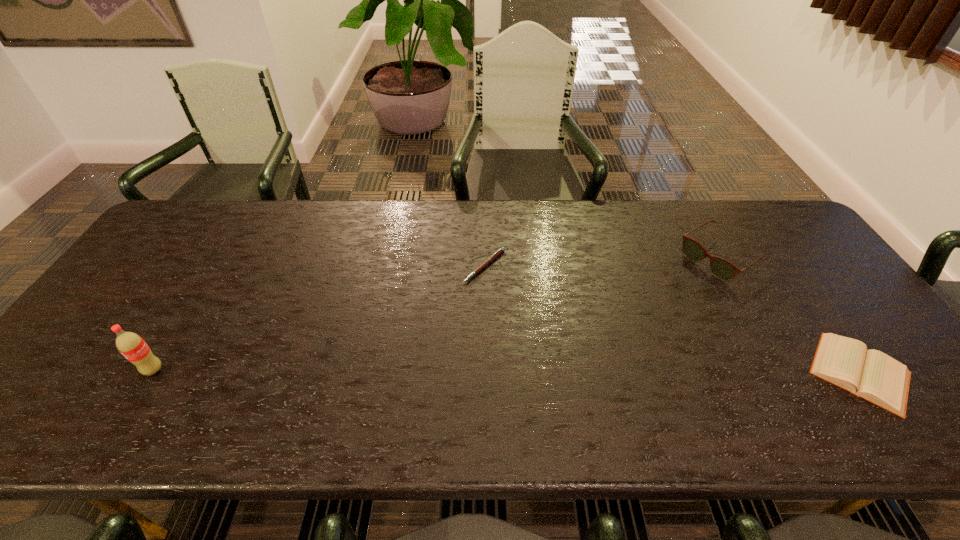
I want to click on vacant region at the near edge of the desktop, so click(770, 381).

I want to click on free space at the right edge of the desktop, so click(847, 299).

Where is `free space at the far left corner`? Image resolution: width=960 pixels, height=540 pixels. free space at the far left corner is located at coordinates (184, 238).

What are the coordinates of `free space at the near left corner of the desktop` in the screenshot? It's located at (68, 399).

In the image, there is a desktop. In order to click on vacant region at the far right corner in this screenshot , I will do `click(777, 225)`.

Locate an element on the screen. free space between the second shortest object and the soda is located at coordinates (507, 371).

Locate an element on the screen. Image resolution: width=960 pixels, height=540 pixels. free spot between the shortest object and the spectacles is located at coordinates (602, 262).

Find the location of a particular element. This screenshot has height=540, width=960. free spot between the diary and the third shortest object is located at coordinates (790, 315).

Where is `vacant space that's between the spectacles and the third tallest object`? The width and height of the screenshot is (960, 540). vacant space that's between the spectacles and the third tallest object is located at coordinates (790, 315).

Locate an element on the screen. Image resolution: width=960 pixels, height=540 pixels. free area in between the third tallest object and the second object from left to right is located at coordinates [672, 319].